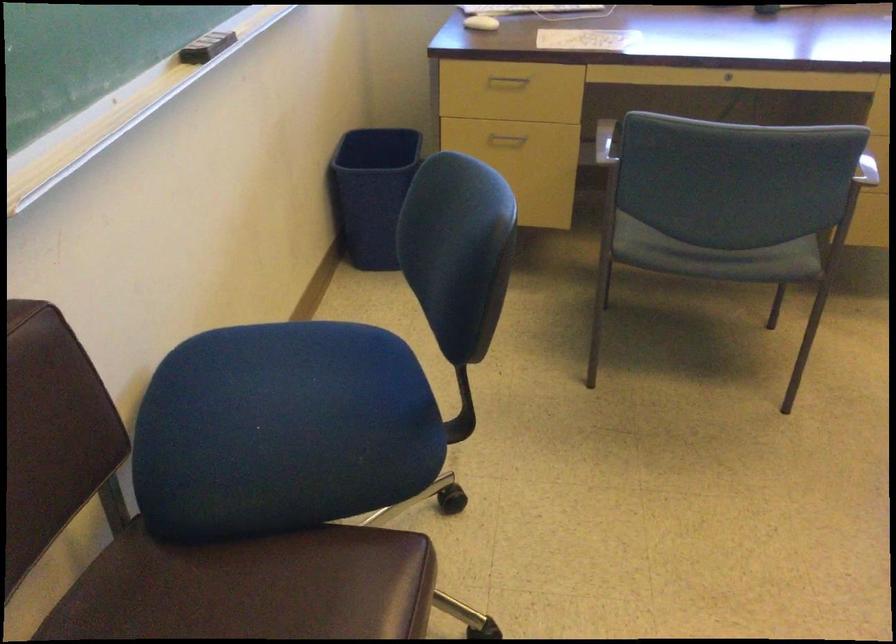
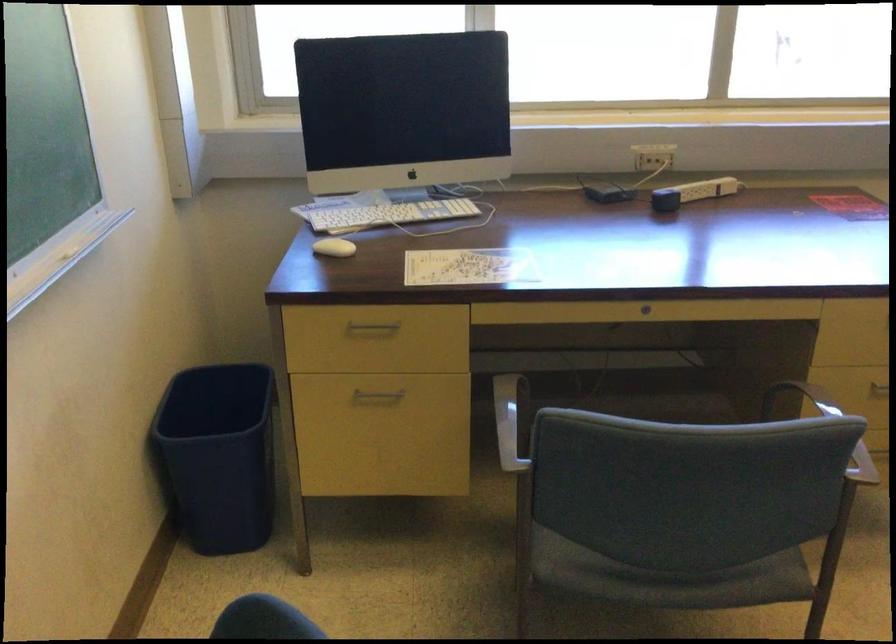
Locate, in the second image, the point that corresponds to [506,79] in the first image.

(373, 327)